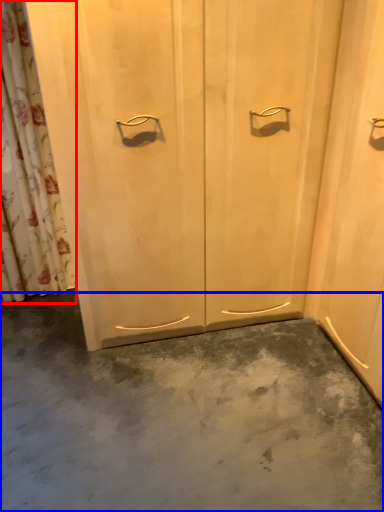
Question: Which object appears farthest to the camera in this image, shower curtain (highlighted by a red box) or concrete (highlighted by a blue box)?

Choices:
 (A) shower curtain
 (B) concrete

Answer: (A)